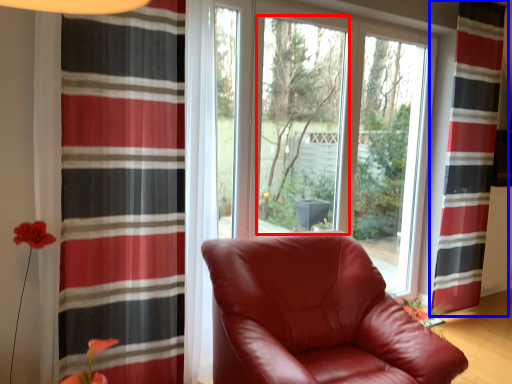
Question: Which point is closer to the camera, window screen (highlighted by a red box) or curtain (highlighted by a blue box)?

Choices:
 (A) window screen
 (B) curtain

Answer: (A)